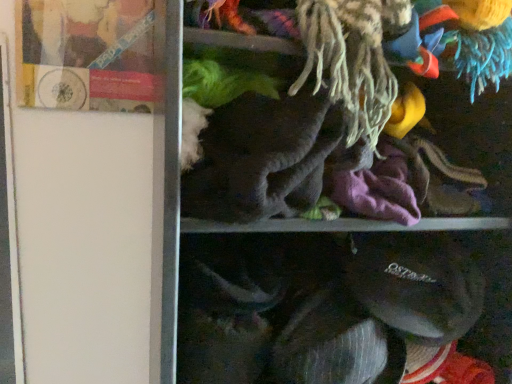
You are a GUI agent. You are given a task and a screenshot of the screen. Output one action in this format:
    pyautogui.click(x=<x>, y=<y>)
    Task: Click on the soft gray fabric at center
    This screenshot has height=384, width=512.
    Given the screenshot: What is the action you would take?
    [337, 100]

The width and height of the screenshot is (512, 384). Describe the element at coordinates (337, 100) in the screenshot. I see `soft gray fabric at center` at that location.

Measure the distance between soft gray fabric at center and camera.

soft gray fabric at center is 19.11 inches from camera.

Identify the location of matte plastic book at upper left. This screenshot has width=512, height=384. (86, 54).

Looking at this image, what is the approximate width of matte plastic book at upper left?

It is 1.30 inches.

Describe the element at coordinates (86, 54) in the screenshot. Image resolution: width=512 pixels, height=384 pixels. I see `matte plastic book at upper left` at that location.

Identify the location of soft gray fabric at center. (337, 100).

Which object is positioned more to the left, soft gray fabric at center or matte plastic book at upper left?

→ matte plastic book at upper left.

Relative to matte plastic book at upper left, is soft gray fabric at center in front or behind?

soft gray fabric at center is in front of matte plastic book at upper left.

Does point (312, 151) come farther from viewer compared to point (41, 97)?

That is False.

From the image's perspective, is soft gray fabric at center under matte plastic book at upper left?

Correct, soft gray fabric at center appears lower than matte plastic book at upper left in the image.

From a real-world perspective, which object rests below the other?

From a 3D spatial view, soft gray fabric at center is below.

Can you confirm if soft gray fabric at center is thinner than matte plastic book at upper left?

No, soft gray fabric at center is not thinner than matte plastic book at upper left.

Does soft gray fabric at center have a lesser height compared to matte plastic book at upper left?

Indeed, soft gray fabric at center has a lesser height compared to matte plastic book at upper left.

Is soft gray fabric at center smaller than matte plastic book at upper left?

No.

Is soft gray fabric at center outside of matte plastic book at upper left?

Absolutely, soft gray fabric at center is external to matte plastic book at upper left.

Is there a large distance between soft gray fabric at center and matte plastic book at upper left?

No, soft gray fabric at center is in close proximity to matte plastic book at upper left.

Could you tell me if soft gray fabric at center is turned towards matte plastic book at upper left?

No, soft gray fabric at center is not oriented towards matte plastic book at upper left.

Can you tell me how much soft gray fabric at center and matte plastic book at upper left differ in facing direction?

0.00156 degrees separate the facing orientations of soft gray fabric at center and matte plastic book at upper left.

The image size is (512, 384). Find the location of `laundry located in front of the matte plastic book at upper left`. laundry located in front of the matte plastic book at upper left is located at coordinates (337, 100).

Which is more to the right, matte plastic book at upper left or soft gray fabric at center?

Positioned to the right is soft gray fabric at center.

Does matte plastic book at upper left lie in front of soft gray fabric at center?

No, the depth of matte plastic book at upper left is greater than that of soft gray fabric at center.

Is point (144, 100) closer or farther from the camera than point (370, 142)?

Point (144, 100) is farther from the camera than point (370, 142).

Looking at this image, from the image's perspective, does matte plastic book at upper left appear lower than soft gray fabric at center?

Actually, matte plastic book at upper left appears above soft gray fabric at center in the image.

From a real-world perspective, which is physically below, matte plastic book at upper left or soft gray fabric at center?

soft gray fabric at center, from a real-world perspective.

From the picture: Which object is thinner, matte plastic book at upper left or soft gray fabric at center?

With smaller width is matte plastic book at upper left.

In terms of height, does matte plastic book at upper left look taller or shorter compared to soft gray fabric at center?

In the image, matte plastic book at upper left appears to be taller than soft gray fabric at center.

Between matte plastic book at upper left and soft gray fabric at center, which one has larger size?

soft gray fabric at center.

Could soft gray fabric at center be considered to be inside matte plastic book at upper left?

Actually, soft gray fabric at center is outside matte plastic book at upper left.

Can you see matte plastic book at upper left touching soft gray fabric at center?

No, matte plastic book at upper left is not making contact with soft gray fabric at center.

Could you tell me if matte plastic book at upper left is turned towards soft gray fabric at center?

No, matte plastic book at upper left does not turn towards soft gray fabric at center.

Where is `laundry that appears on the right of matte plastic book at upper left`? laundry that appears on the right of matte plastic book at upper left is located at coordinates (337, 100).

Where is `laundry that is under the matte plastic book at upper left (from a real-world perspective)`? laundry that is under the matte plastic book at upper left (from a real-world perspective) is located at coordinates (x=337, y=100).

The image size is (512, 384). In order to click on book behind the soft gray fabric at center in this screenshot , I will do `click(86, 54)`.